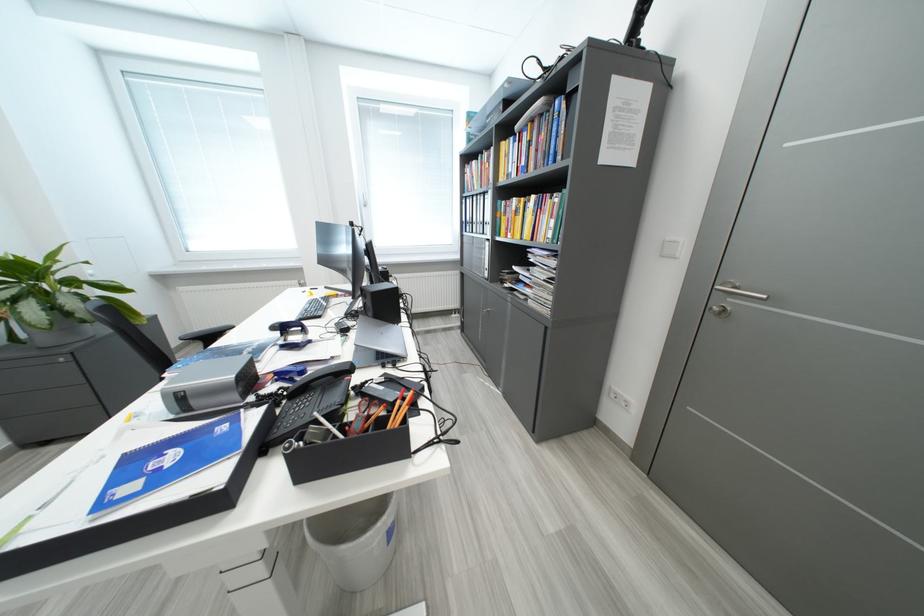
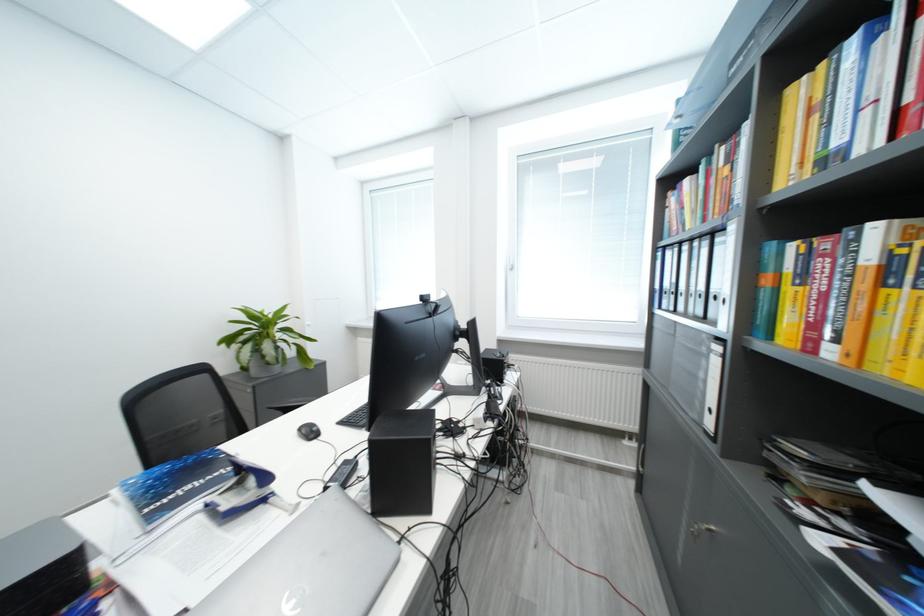
Question: The first image is from the beginning of the video and the second image is from the end. How did the camera likely rotate when shooting the video?

Choices:
 (A) Left
 (B) Right
 (C) Up
 (D) Down

Answer: (A)